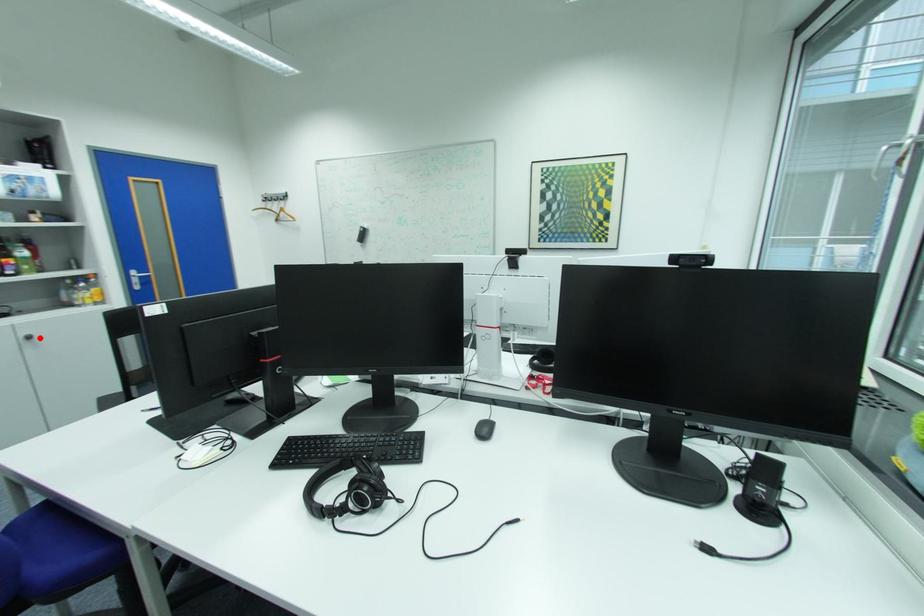
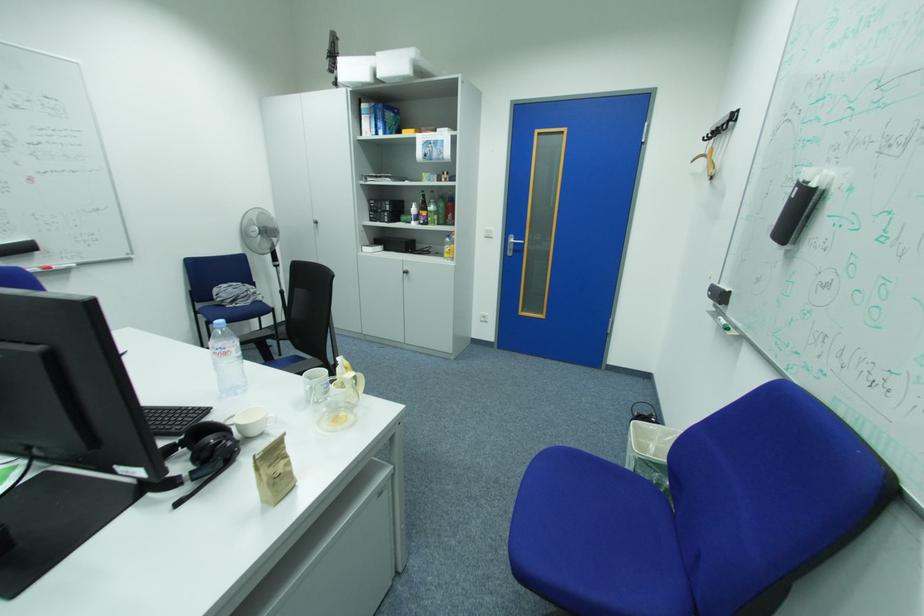
Question: I am providing you with two images of the same scene from different viewpoints. Given a red point in image1, look at the same physical point in image2. Is it:

Choices:
 (A) Closer to the viewpoint
 (B) Farther from the viewpoint

Answer: (A)